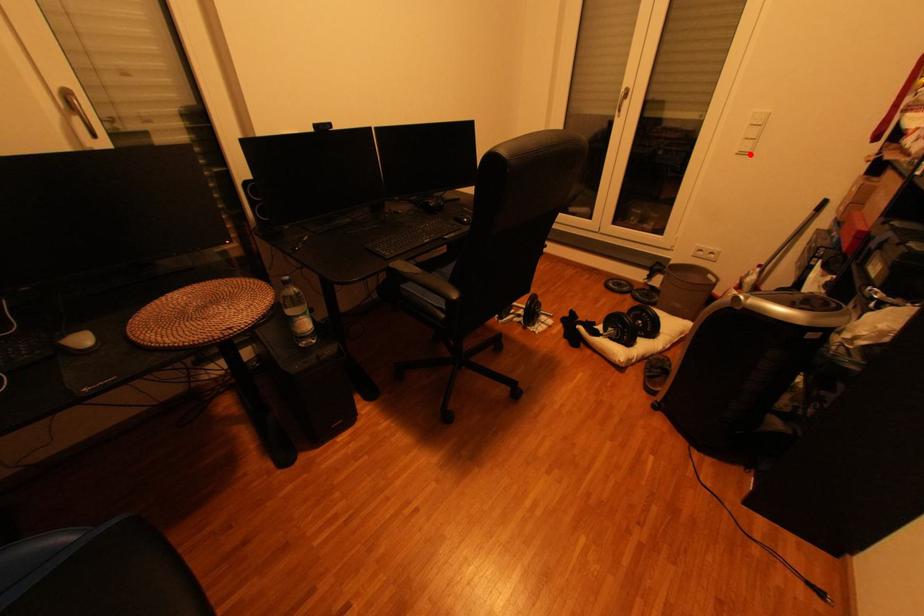
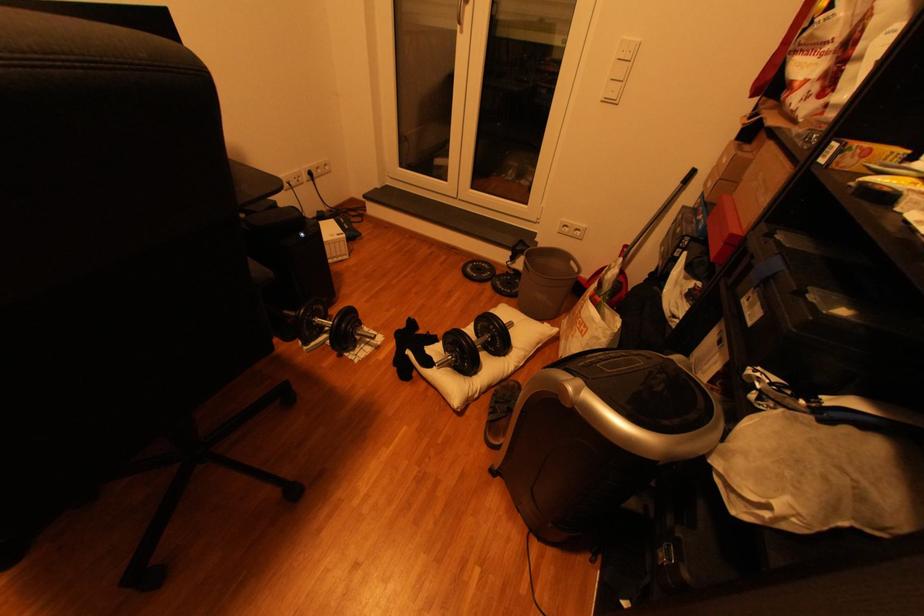
Where in the second image is the point corresponding to the highlighted location from the first image?

(614, 100)